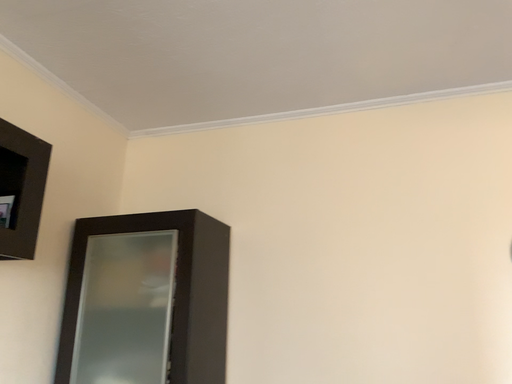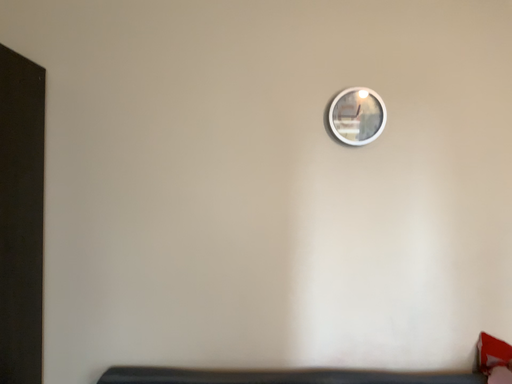
Question: Which way did the camera rotate in the video?

Choices:
 (A) rotated left
 (B) rotated right

Answer: (B)